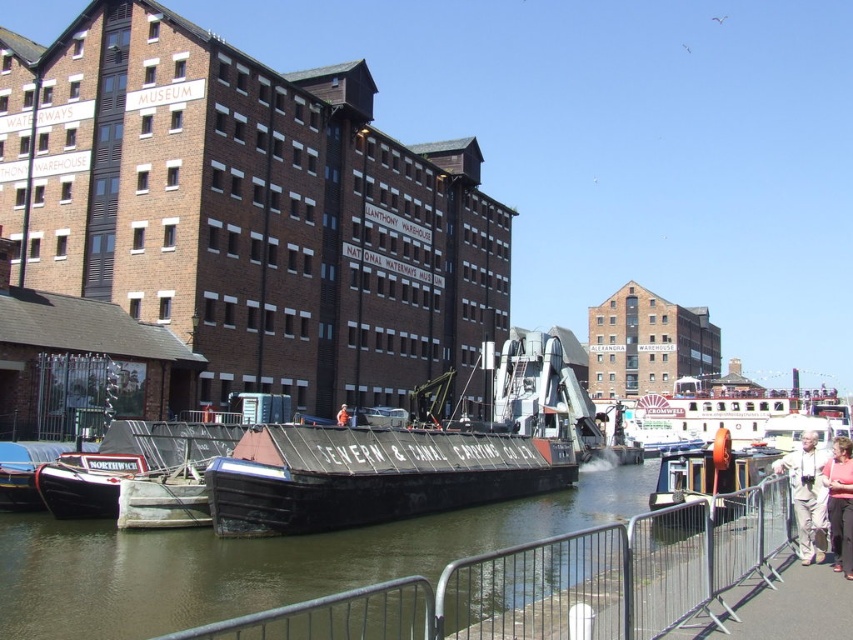
You are a photographer planning to take a picture of the waterfront scene. You want to include both the pink fabric at lower right and the orange life vest at center in your shot. Which object will occupy more space in the photo?

The pink fabric at lower right is bigger than the orange life vest at center, so it will occupy more space in the photo.